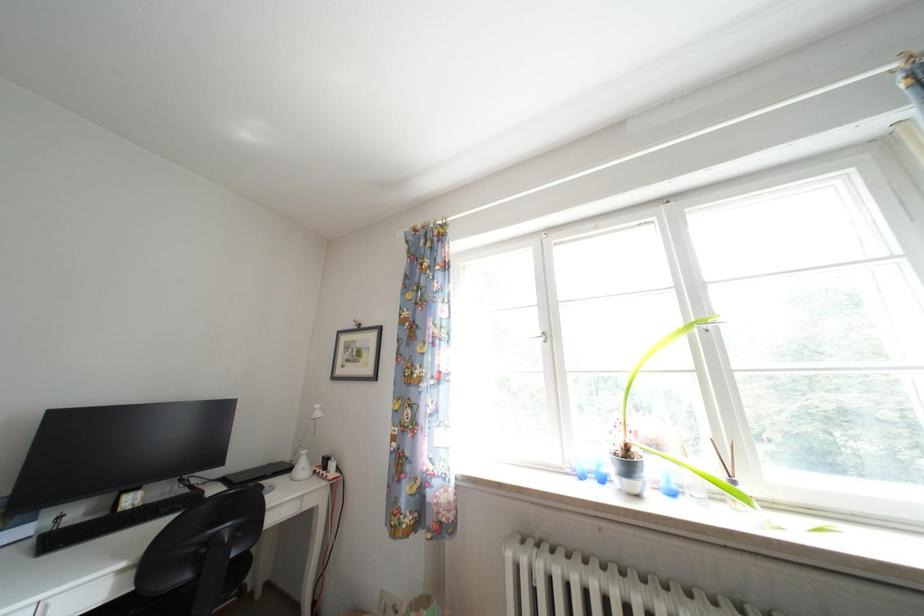
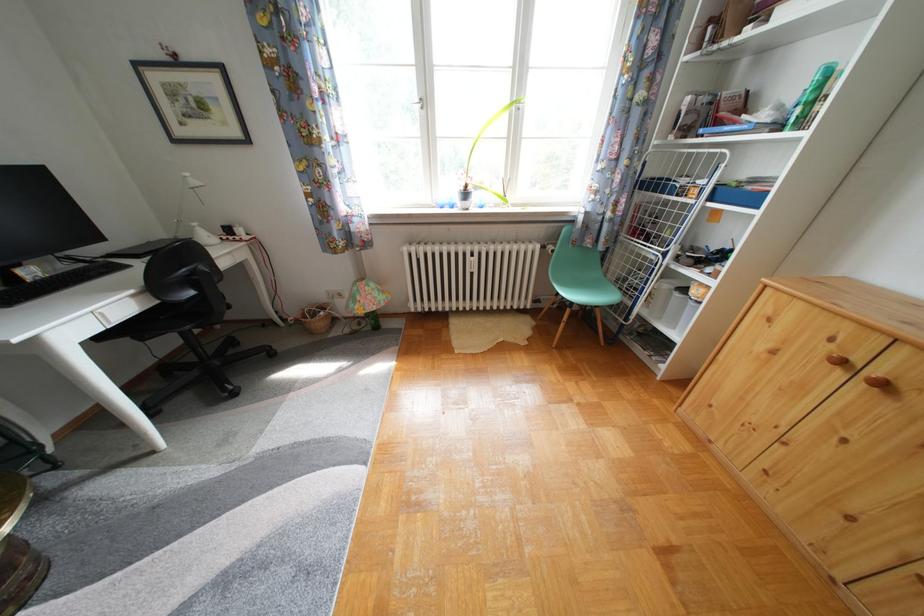
Based on the continuous images, in which direction is the camera rotating?

The rotation direction of the camera is right-down.